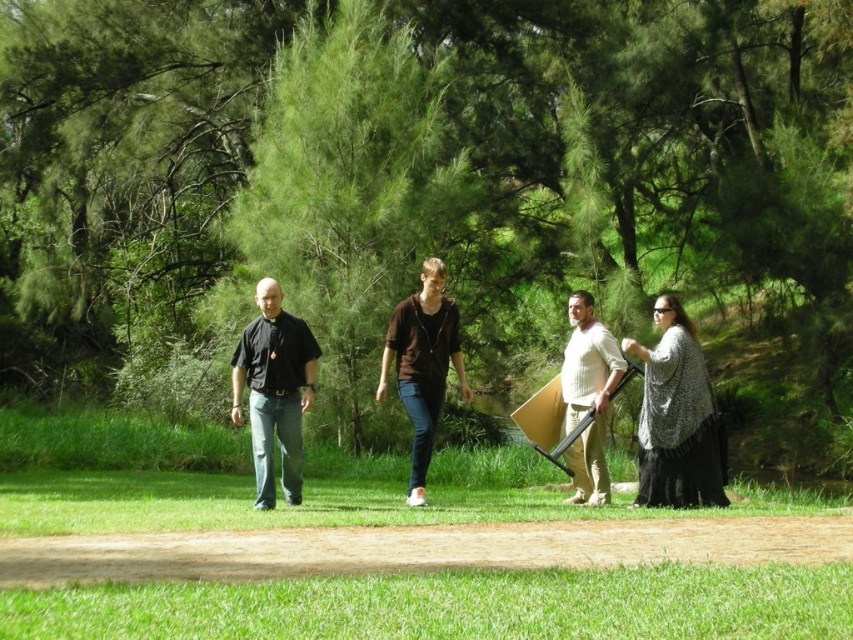
Question: Which point is farther to the camera?

Choices:
 (A) green grass at lower center
 (B) black matte shirt at left

Answer: (B)

Question: Observing the image, what is the correct spatial positioning of brown cotton hoodie at center in reference to knit sweater at center?

Choices:
 (A) right
 (B) left

Answer: (B)

Question: Which object appears farthest from the camera in this image?

Choices:
 (A) green grass at lower center
 (B) black matte shirt at left
 (C) knit sweater at center

Answer: (C)

Question: Observing the image, what is the correct spatial positioning of patterned knit sweater at right in reference to black matte shirt at left?

Choices:
 (A) right
 (B) left

Answer: (A)

Question: Does black matte shirt at left appear over brown cotton hoodie at center?

Choices:
 (A) yes
 (B) no

Answer: (B)

Question: Which of the following is the closest to the observer?

Choices:
 (A) black matte shirt at left
 (B) patterned knit sweater at right

Answer: (B)